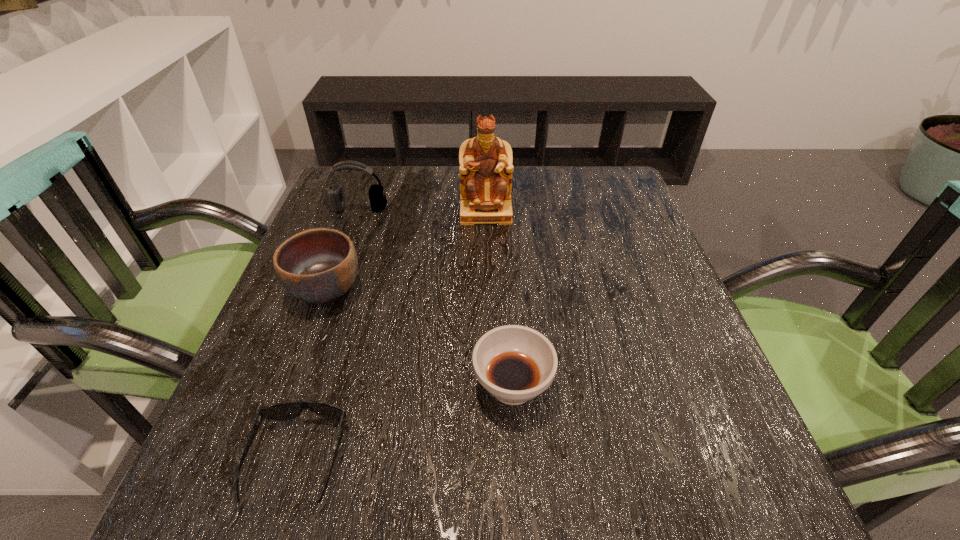
Where is `vacant region between the sunglasses and the headset`? The width and height of the screenshot is (960, 540). vacant region between the sunglasses and the headset is located at coordinates (328, 334).

Find the location of a particular element. The height and width of the screenshot is (540, 960). free point between the headset and the shortest object is located at coordinates (328, 334).

Where is `vacant point located between the figurine and the shortest object`? vacant point located between the figurine and the shortest object is located at coordinates (392, 336).

Where is `vacant region between the sunglasses and the second shortest object`? This screenshot has height=540, width=960. vacant region between the sunglasses and the second shortest object is located at coordinates coord(405,423).

Identify the location of the fourth closest object to the shortest object. (335, 200).

Identify which object is located as the third nearest to the sunglasses. Please provide its 2D coordinates. Your answer should be formatted as a tuple, i.e. [(x, y)], where the tuple contains the x and y coordinates of a point satisfying the conditions above.

[(485, 161)]

The height and width of the screenshot is (540, 960). What are the coordinates of `vacant region that satisfies the following two spatial constraints: 1. on the headband of the fourth shortest object; 2. on the right side of the second shortest object` in the screenshot? It's located at (296, 386).